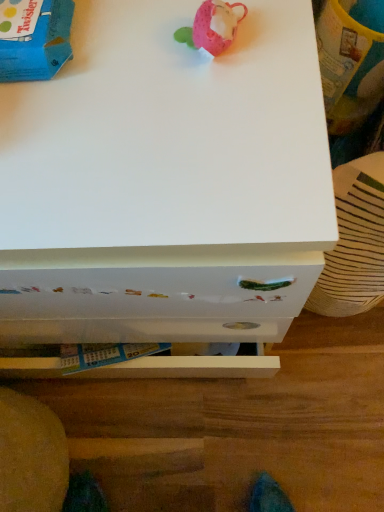
Where is `space that is in front of blue cardboard box at upper left, which is counted as the first toy, starting from the left`? The height and width of the screenshot is (512, 384). space that is in front of blue cardboard box at upper left, which is counted as the first toy, starting from the left is located at coordinates (87, 163).